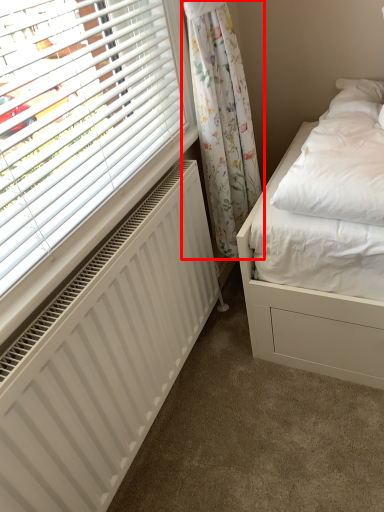
Question: From the image's perspective, where is curtain (annotated by the red box) located in relation to radiator in the image?

Choices:
 (A) above
 (B) below

Answer: (A)